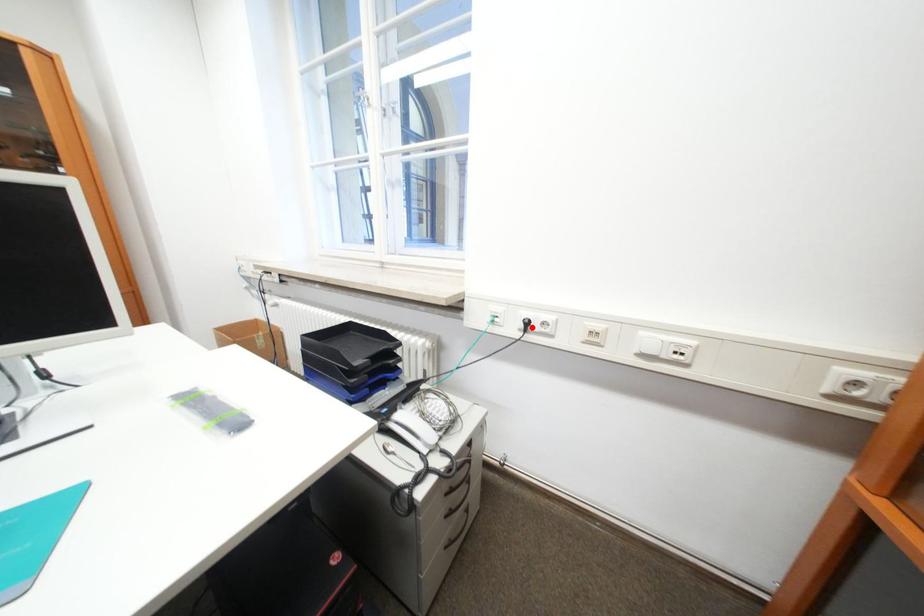
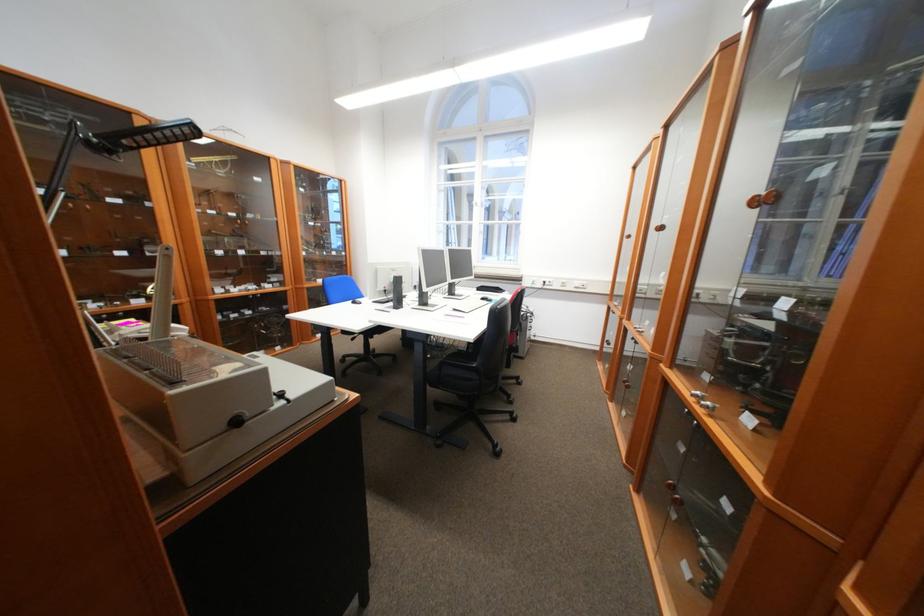
Find the pixel in the second image that matches the highlighted location in the first image.

(553, 284)